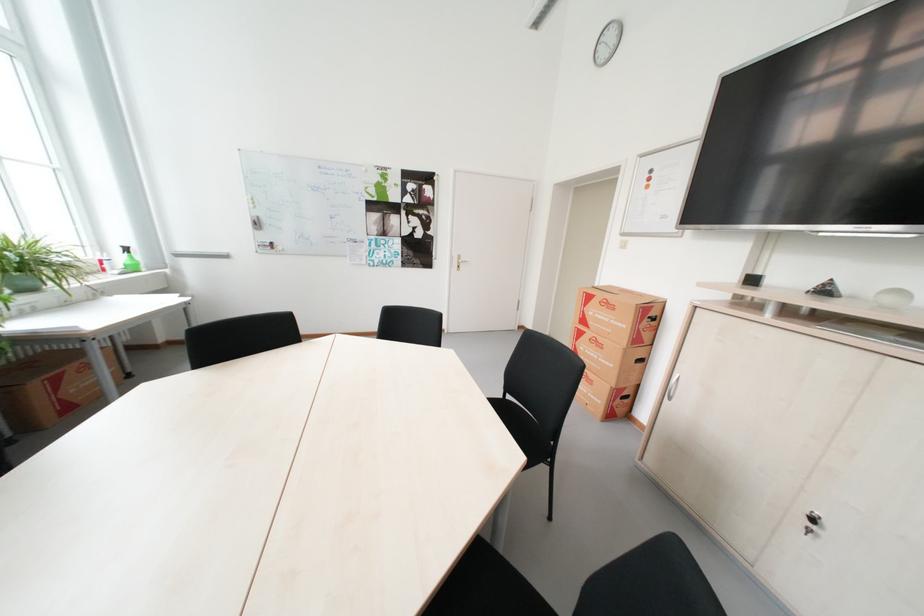
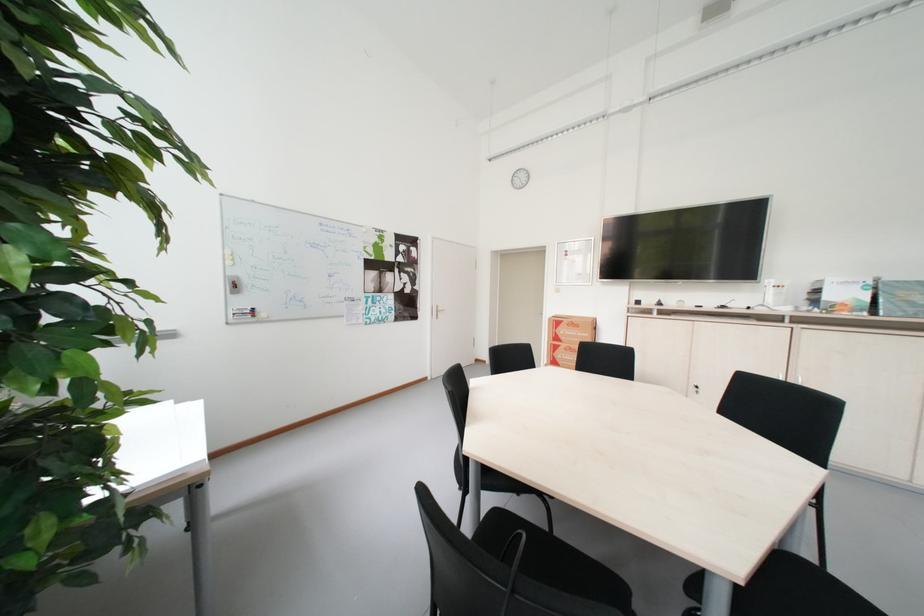
In the second image, find the point that corresponds to (x=600, y=334) in the first image.

(573, 347)